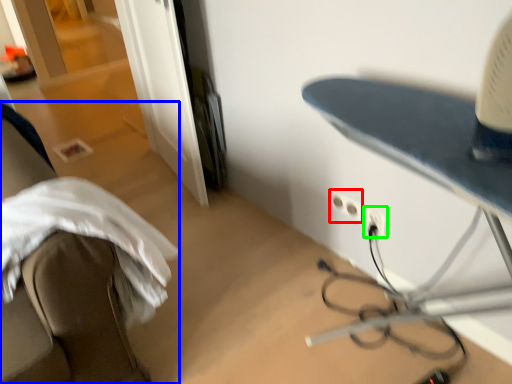
Question: Based on their relative distances, which object is nearer to electric outlet (highlighted by a red box)? Choose from furniture (highlighted by a blue box) and electric outlet (highlighted by a green box).

Choices:
 (A) furniture
 (B) electric outlet

Answer: (B)